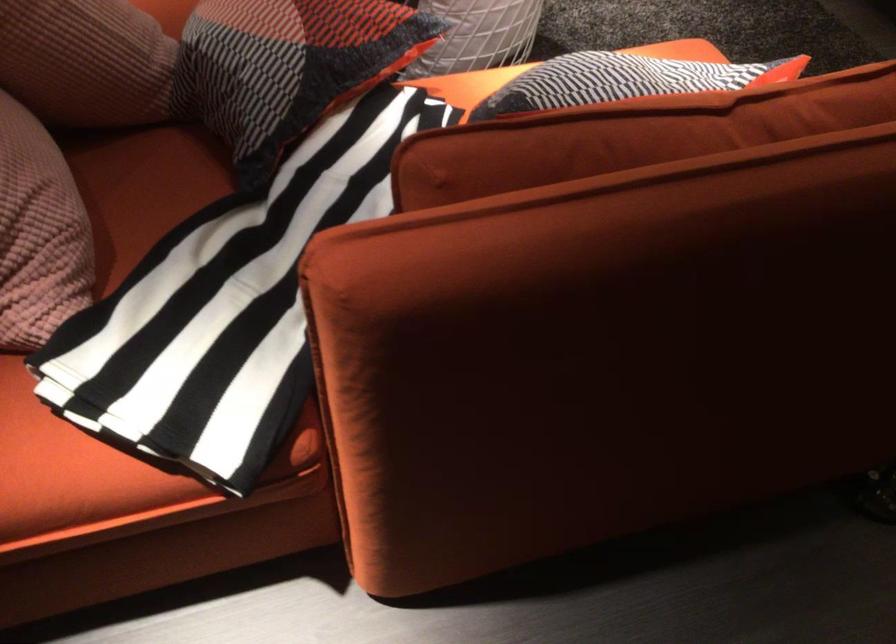
Image resolution: width=896 pixels, height=644 pixels. I want to click on plaid pillow, so click(288, 67).